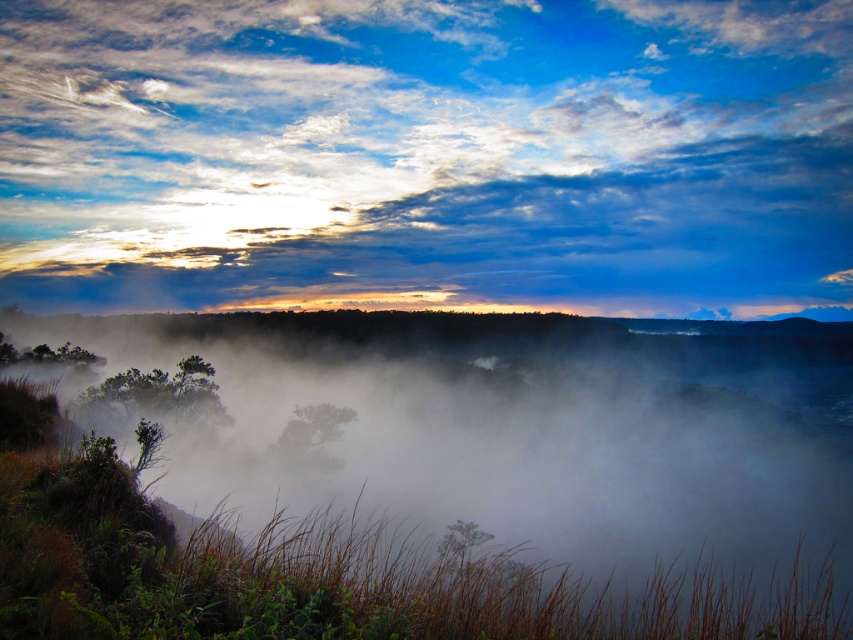
Question: Which point is closer to the camera?

Choices:
 (A) cloudy sky at upper center
 (B) white misty fog at center

Answer: (B)

Question: Is cloudy sky at upper center bigger than white misty fog at center?

Choices:
 (A) yes
 (B) no

Answer: (A)

Question: Among these points, which one is farthest from the camera?

Choices:
 (A) (392, 609)
 (B) (799, 182)

Answer: (B)

Question: Can you confirm if cloudy sky at upper center is wider than white misty fog at center?

Choices:
 (A) yes
 (B) no

Answer: (A)

Question: Does cloudy sky at upper center have a larger size compared to white misty fog at center?

Choices:
 (A) yes
 (B) no

Answer: (A)